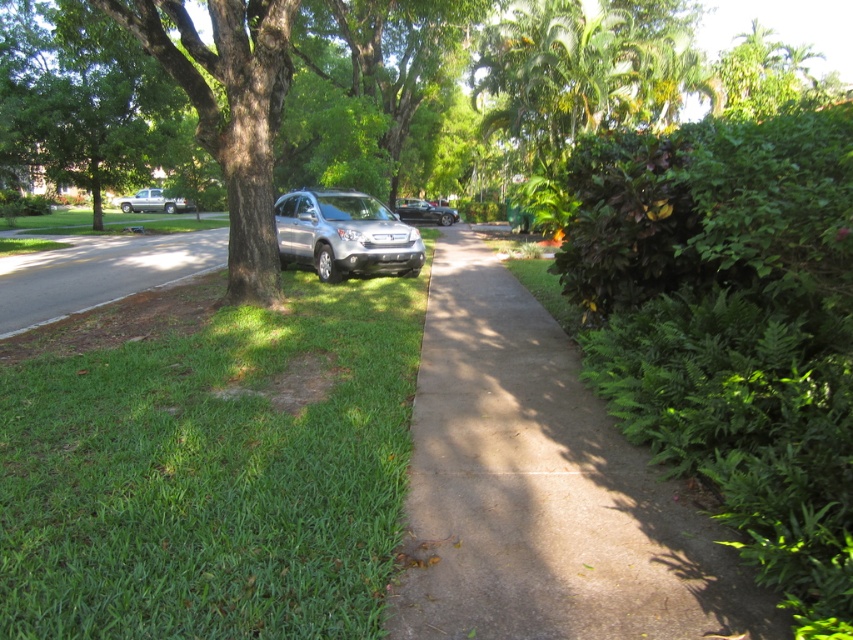
Question: In this image, where is satin silver suv at center located relative to silver metallic truck at left?

Choices:
 (A) left
 (B) right

Answer: (B)

Question: Does green grass at left have a lesser width compared to concrete at center?

Choices:
 (A) yes
 (B) no

Answer: (B)

Question: Which point is closer to the camera?

Choices:
 (A) (166, 202)
 (B) (506, 349)
 (C) (25, 264)
 (D) (787, 400)

Answer: (D)

Question: Which point appears farthest from the camera in this image?

Choices:
 (A) (445, 211)
 (B) (659, 481)
 (C) (16, 307)

Answer: (A)

Question: Is green grass at left below concrete at center?

Choices:
 (A) yes
 (B) no

Answer: (B)

Question: Which object is positioned farthest from the concrete at center?

Choices:
 (A) satin silver suv at center
 (B) green grass at lower left

Answer: (B)